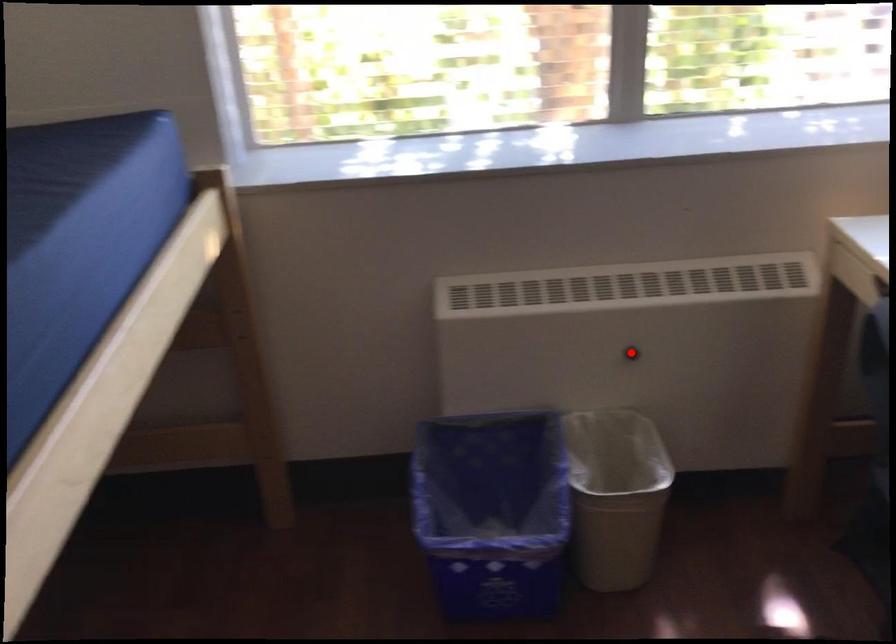
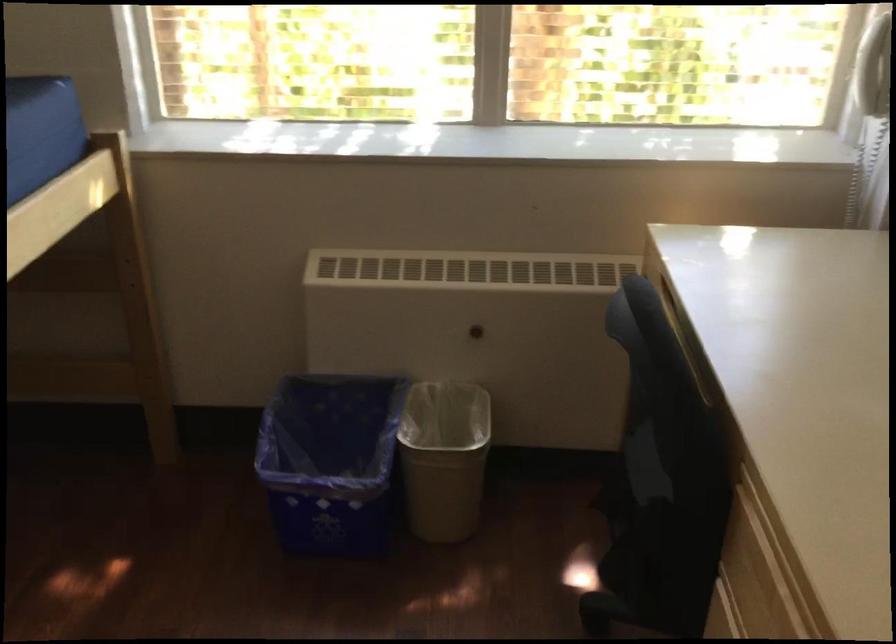
Question: I am providing you with two images of the same scene from different viewpoints. Image1 has a red point marked. In image2, the corresponding 3D location appears at what relative position? Reply with the corresponding letter.

Choices:
 (A) Closer
 (B) Farther

Answer: (B)